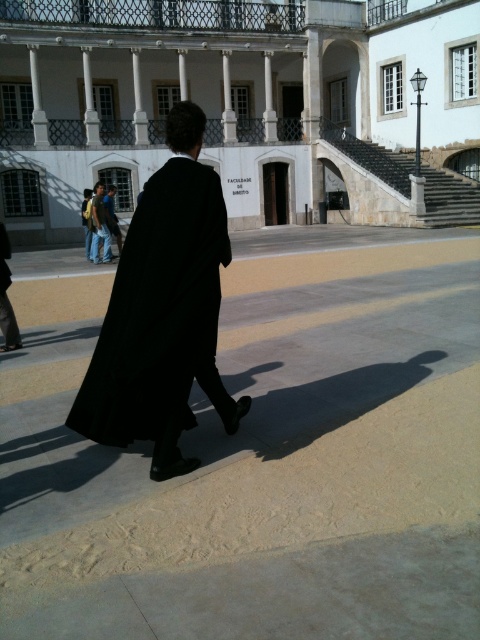
Question: Can you confirm if black matte coat at center is positioned to the left of denim jeans at lower left?

Choices:
 (A) yes
 (B) no

Answer: (B)

Question: Which of the following is the closest to the observer?

Choices:
 (A) (60, 209)
 (B) (105, 243)
 (C) (78, 433)

Answer: (C)

Question: Which object is the farthest from the white stone building at center?

Choices:
 (A) denim jeans at lower left
 (B) black matte coat at center

Answer: (B)

Question: Which of the following is the farthest from the observer?

Choices:
 (A) black matte coat at center
 (B) white stone building at center

Answer: (B)

Question: Where is white stone building at center located in relation to denim jeans at lower left in the image?

Choices:
 (A) left
 (B) right

Answer: (B)

Question: Can you confirm if black matte coat at center is wider than denim jeans at lower left?

Choices:
 (A) yes
 (B) no

Answer: (A)